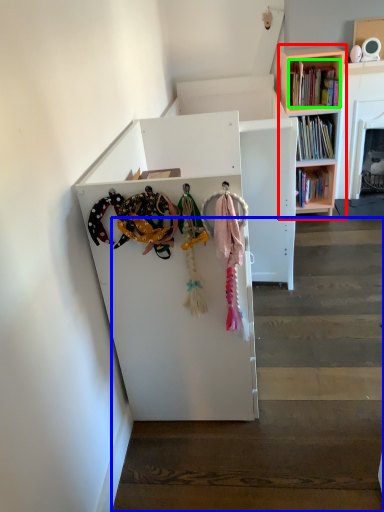
Question: Considering the real-world distances, which object is farthest from bookcase (highlighted by a red box)? stairwell (highlighted by a blue box) or book (highlighted by a green box)?

Choices:
 (A) stairwell
 (B) book

Answer: (A)